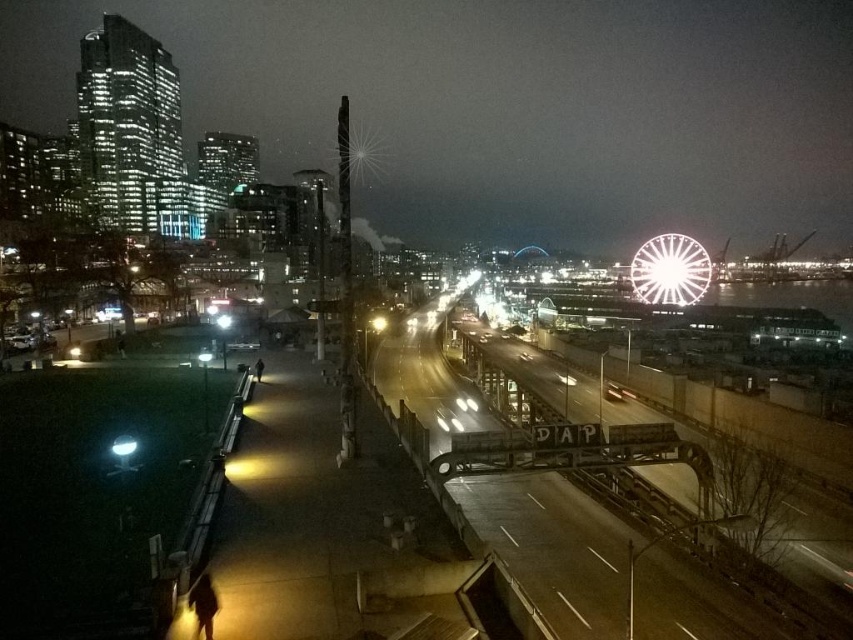
Consider the image. You are a photographer planning to capture a cityscape that includes both the metallic bridge at center and the white metallic ferris wheel at upper right. Based on their positions, which object should you place closer to the left side of your camera frame?

The metallic bridge at center should be placed closer to the left side of your camera frame because it is positioned on the left side of the white metallic ferris wheel at upper right.

You are a city planner assessing the feasibility of installing a new observation deck between the metallic bridge at center and the white metallic ferris wheel at upper right. The deck requires a minimum of 100 meters of space between the two structures to accommodate safety regulations. Based on the provided information, is the current distance sufficient for this project?

The distance between the metallic bridge at center and the white metallic ferris wheel at upper right is 95.34 meters, which is less than the required 100 meters. Therefore, the current distance is insufficient to meet the safety regulations for the observation deck project.